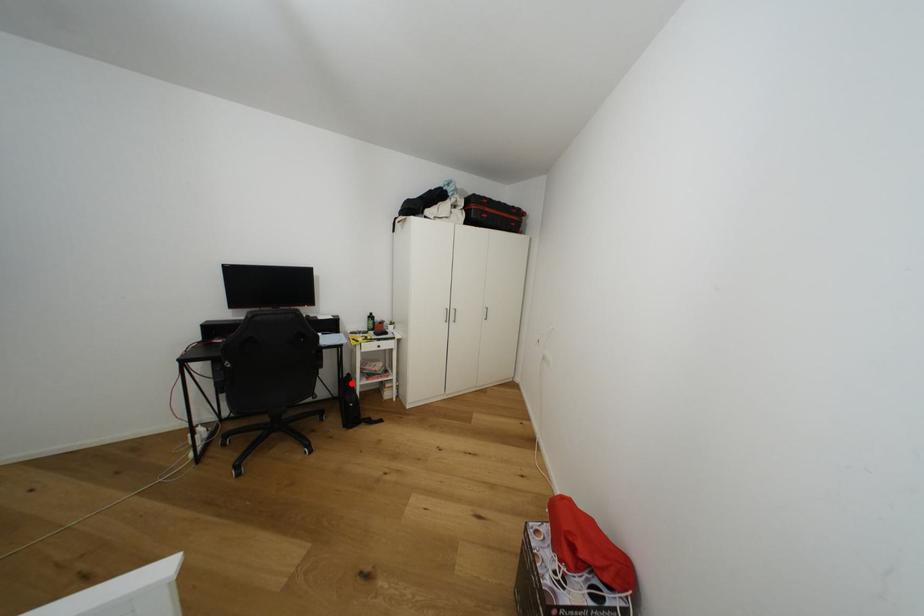
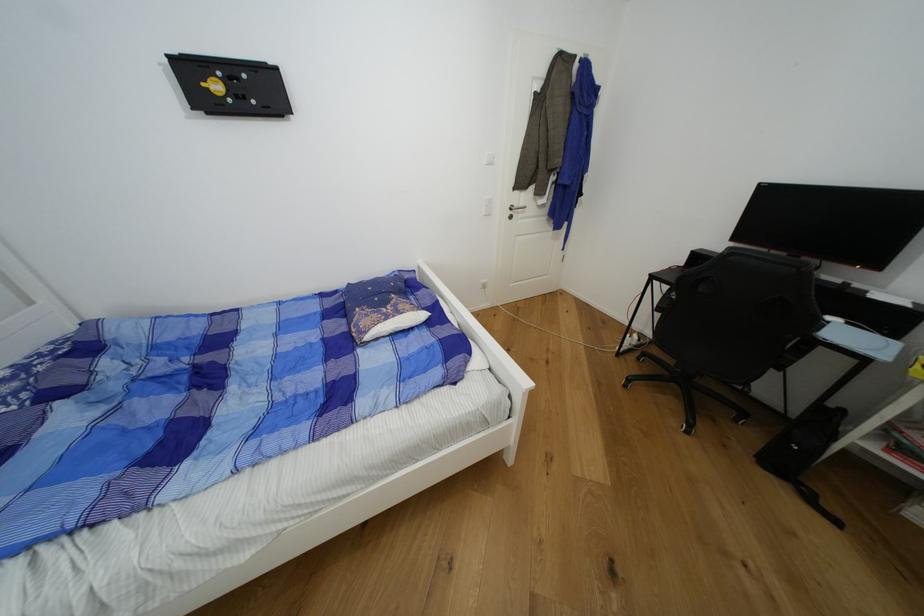
Find the pixel in the second image that matches the highlighted location in the first image.

(833, 418)